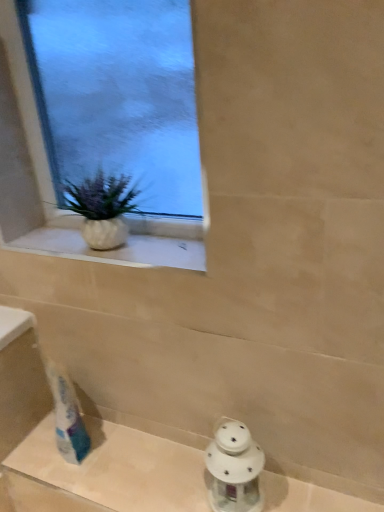
Question: Considering the relative sizes of clear glass window at upper left and white textured vase at upper left in the image provided, is clear glass window at upper left bigger than white textured vase at upper left?

Choices:
 (A) yes
 (B) no

Answer: (A)

Question: Is clear glass window at upper left thinner than white textured vase at upper left?

Choices:
 (A) no
 (B) yes

Answer: (B)

Question: From the image's perspective, is clear glass window at upper left located above white textured vase at upper left?

Choices:
 (A) yes
 (B) no

Answer: (A)

Question: Is clear glass window at upper left aimed at white textured vase at upper left?

Choices:
 (A) yes
 (B) no

Answer: (A)

Question: Is white textured vase at upper left inside clear glass window at upper left?

Choices:
 (A) yes
 (B) no

Answer: (B)

Question: Is point (34, 217) closer or farther from the camera than point (124, 239)?

Choices:
 (A) closer
 (B) farther

Answer: (B)

Question: Considering their positions, is clear glass window at upper left located in front of or behind white textured vase at upper left?

Choices:
 (A) front
 (B) behind

Answer: (A)

Question: Is clear glass window at upper left inside the boundaries of white textured vase at upper left, or outside?

Choices:
 (A) inside
 (B) outside

Answer: (B)

Question: Considering the positions of clear glass window at upper left and white textured vase at upper left in the image, is clear glass window at upper left bigger or smaller than white textured vase at upper left?

Choices:
 (A) big
 (B) small

Answer: (A)

Question: From the image's perspective, is white glass lantern at lower center above or below white porcelain lantern at lower right?

Choices:
 (A) above
 (B) below

Answer: (B)

Question: From a real-world perspective, is white glass lantern at lower center physically located above or below white porcelain lantern at lower right?

Choices:
 (A) below
 (B) above

Answer: (A)

Question: Is point (127, 495) positioned closer to the camera than point (244, 429)?

Choices:
 (A) closer
 (B) farther

Answer: (B)

Question: In terms of size, does white glass lantern at lower center appear bigger or smaller than white porcelain lantern at lower right?

Choices:
 (A) big
 (B) small

Answer: (A)

Question: Is white glass lantern at lower center inside the boundaries of white textured vase at upper left, or outside?

Choices:
 (A) outside
 (B) inside

Answer: (A)

Question: Looking at the image, does white glass lantern at lower center seem bigger or smaller compared to white textured vase at upper left?

Choices:
 (A) small
 (B) big

Answer: (A)